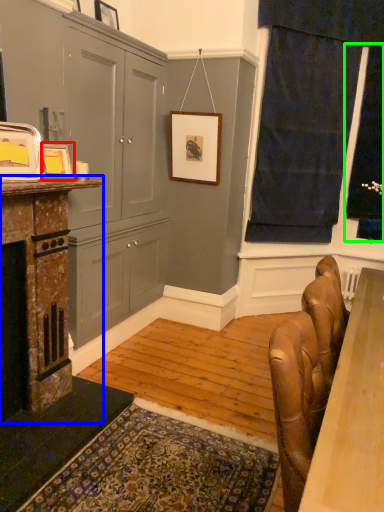
Question: Which object is the farthest from picture frame (highlighted by a red box)? Choose among these: fireplace (highlighted by a blue box) or window screen (highlighted by a green box).

Choices:
 (A) fireplace
 (B) window screen

Answer: (B)